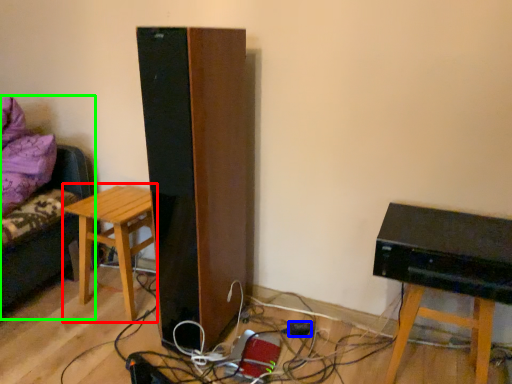
Question: Considering the real-world distances, which object is farthest from stool (highlighted by a red box)? plug (highlighted by a blue box) or furniture (highlighted by a green box)?

Choices:
 (A) plug
 (B) furniture

Answer: (A)